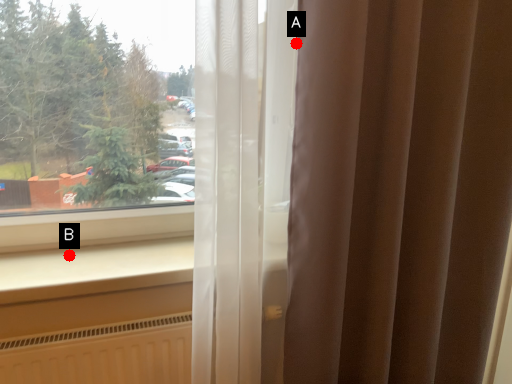
Question: Two points are circled on the image, labeled by A and B beside each circle. Which of the following is the farthest from the observer?

Choices:
 (A) A is further
 (B) B is further

Answer: (B)